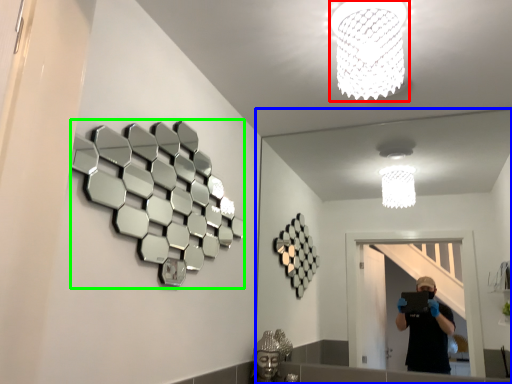
Question: Which object is the closest to the lamp (highlighted by a red box)? Choose among these: mirror (highlighted by a blue box) or mirror (highlighted by a green box).

Choices:
 (A) mirror
 (B) mirror

Answer: (B)